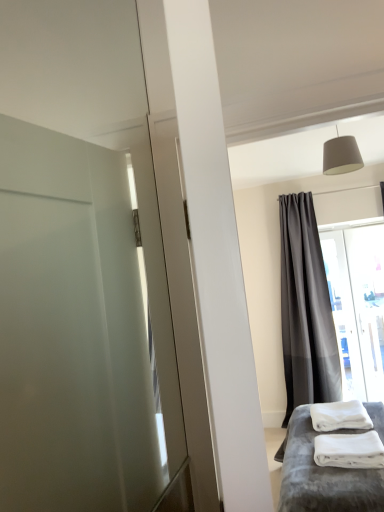
Question: Should I look upward or downward to see dark gray sheer curtain at upper right?

Choices:
 (A) up
 (B) down

Answer: (B)

Question: Is transparent glass window at right far away from dark gray sheer curtain at upper right?

Choices:
 (A) yes
 (B) no

Answer: (B)

Question: Is transparent glass window at right oriented away from dark gray sheer curtain at upper right?

Choices:
 (A) no
 (B) yes

Answer: (A)

Question: Considering the relative positions of transparent glass window at right and dark gray sheer curtain at upper right in the image provided, is transparent glass window at right to the right of dark gray sheer curtain at upper right from the viewer's perspective?

Choices:
 (A) no
 (B) yes

Answer: (B)

Question: Is transparent glass window at right completely or partially outside of dark gray sheer curtain at upper right?

Choices:
 (A) yes
 (B) no

Answer: (A)

Question: Is transparent glass window at right at the left side of dark gray sheer curtain at upper right?

Choices:
 (A) no
 (B) yes

Answer: (A)

Question: Is transparent glass window at right surrounding dark gray sheer curtain at upper right?

Choices:
 (A) no
 (B) yes

Answer: (A)

Question: Could dark gray sheer curtain at upper right be considered to be inside white fluffy bath towel at lower right?

Choices:
 (A) yes
 (B) no

Answer: (B)

Question: Is the position of white fluffy bath towel at lower right less distant than that of dark gray sheer curtain at upper right?

Choices:
 (A) no
 (B) yes

Answer: (B)

Question: Would you consider white fluffy bath towel at lower right to be distant from dark gray sheer curtain at upper right?

Choices:
 (A) yes
 (B) no

Answer: (A)

Question: Is white fluffy bath towel at lower right bigger than dark gray sheer curtain at upper right?

Choices:
 (A) yes
 (B) no

Answer: (B)

Question: Can you confirm if white fluffy bath towel at lower right is thinner than dark gray sheer curtain at upper right?

Choices:
 (A) no
 (B) yes

Answer: (A)

Question: From the image's perspective, is white fluffy bath towel at lower right under dark gray sheer curtain at upper right?

Choices:
 (A) yes
 (B) no

Answer: (A)

Question: Can you confirm if white soft towels at lower right is wider than matte gray lampshade at upper center?

Choices:
 (A) yes
 (B) no

Answer: (A)